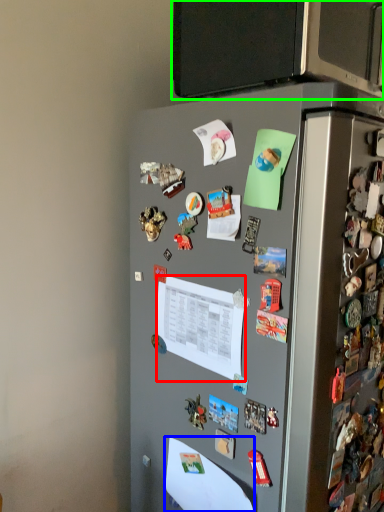
Question: Considering the real-world distances, which object is closest to paper (highlighted by a red box)? paper (highlighted by a blue box) or back (highlighted by a green box).

Choices:
 (A) paper
 (B) back

Answer: (A)